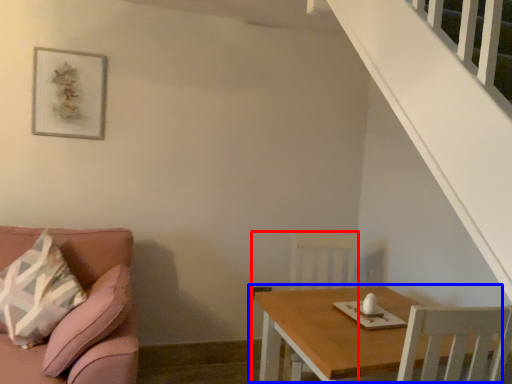
Question: Which object appears farthest to the camera in this image, armchair (highlighted by a red box) or table (highlighted by a blue box)?

Choices:
 (A) armchair
 (B) table

Answer: (A)